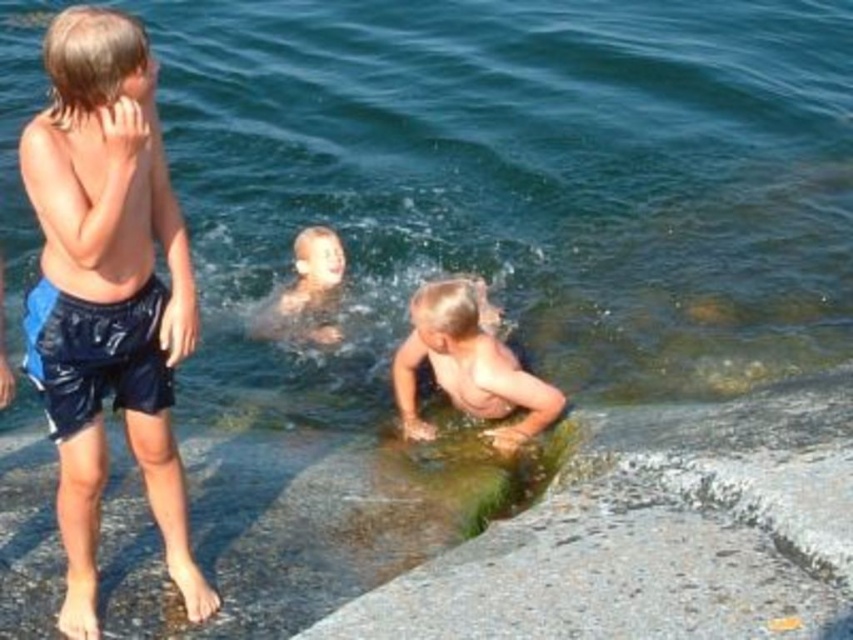
Between point (671, 560) and point (300, 307), which one is positioned in front?

Positioned in front is point (671, 560).

Between green mossy rock at lower center and smooth skin child at center, which one is positioned lower?

Positioned lower is green mossy rock at lower center.

Between point (764, 612) and point (339, 252), which one is positioned behind?

Positioned behind is point (339, 252).

Where is `green mossy rock at lower center`? Image resolution: width=853 pixels, height=640 pixels. green mossy rock at lower center is located at coordinates (656, 532).

What do you see at coordinates (467, 368) in the screenshot? I see `light brown skin at lower center` at bounding box center [467, 368].

Between light brown skin at lower center and smooth skin child at center, which one is positioned lower?

light brown skin at lower center is below.

Find the location of a particular element. This screenshot has height=640, width=853. light brown skin at lower center is located at coordinates (467, 368).

Is green mossy rock at lower center smaller than blue shiny shorts at left?

Incorrect, green mossy rock at lower center is not smaller in size than blue shiny shorts at left.

Does green mossy rock at lower center appear on the right side of blue shiny shorts at left?

Correct, you'll find green mossy rock at lower center to the right of blue shiny shorts at left.

Is point (402, 605) positioned in front of point (148, 172)?

That is True.

Where is `green mossy rock at lower center`? This screenshot has height=640, width=853. green mossy rock at lower center is located at coordinates (656, 532).